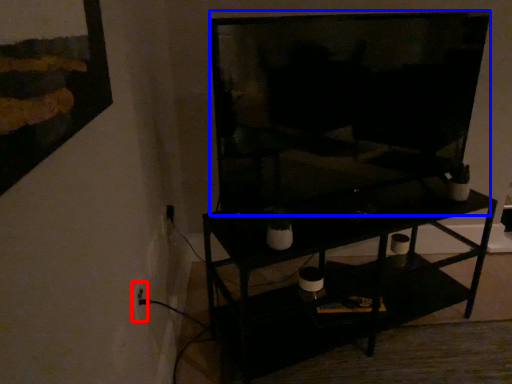
Question: Among these objects, which one is nearest to the camera, electric outlet (highlighted by a red box) or television (highlighted by a blue box)?

Choices:
 (A) electric outlet
 (B) television

Answer: (B)